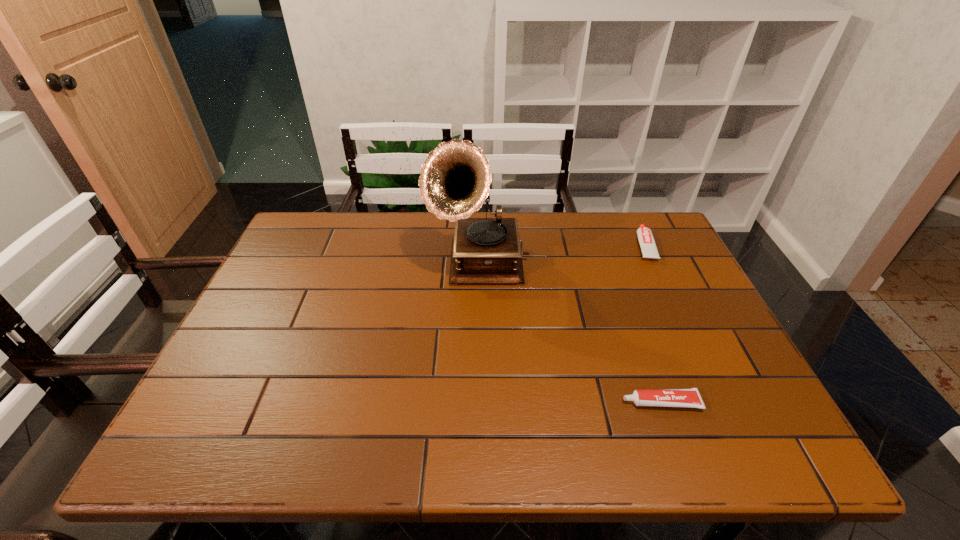
The height and width of the screenshot is (540, 960). I want to click on vacant space located at the nozzle of the left toothpaste, so [x=531, y=402].

Identify the location of record player at the far edge. This screenshot has height=540, width=960. 454,182.

Image resolution: width=960 pixels, height=540 pixels. What are the coordinates of `toothpaste present at the far edge` in the screenshot? It's located at (646, 240).

The image size is (960, 540). In order to click on object that is positioned at the far right corner in this screenshot , I will do `click(646, 240)`.

In the image, there is a desktop. At what (x,y) coordinates should I click in order to perform the action: click on vacant space at the far edge. Please return your answer as a coordinate pair (x, y). The width and height of the screenshot is (960, 540). Looking at the image, I should click on (527, 211).

At what (x,y) coordinates should I click in order to perform the action: click on free point at the near edge. Please return your answer as a coordinate pair (x, y). This screenshot has height=540, width=960. Looking at the image, I should click on coord(395,438).

The height and width of the screenshot is (540, 960). In the image, there is a desktop. Find the location of `vacant region at the left edge`. vacant region at the left edge is located at coordinates (254, 362).

The height and width of the screenshot is (540, 960). What are the coordinates of `blank space at the right edge of the desktop` in the screenshot? It's located at (675, 276).

Find the location of a particular element. Image resolution: width=960 pixels, height=540 pixels. vacant area at the near left corner is located at coordinates (214, 442).

I want to click on free space at the near right corner, so click(748, 429).